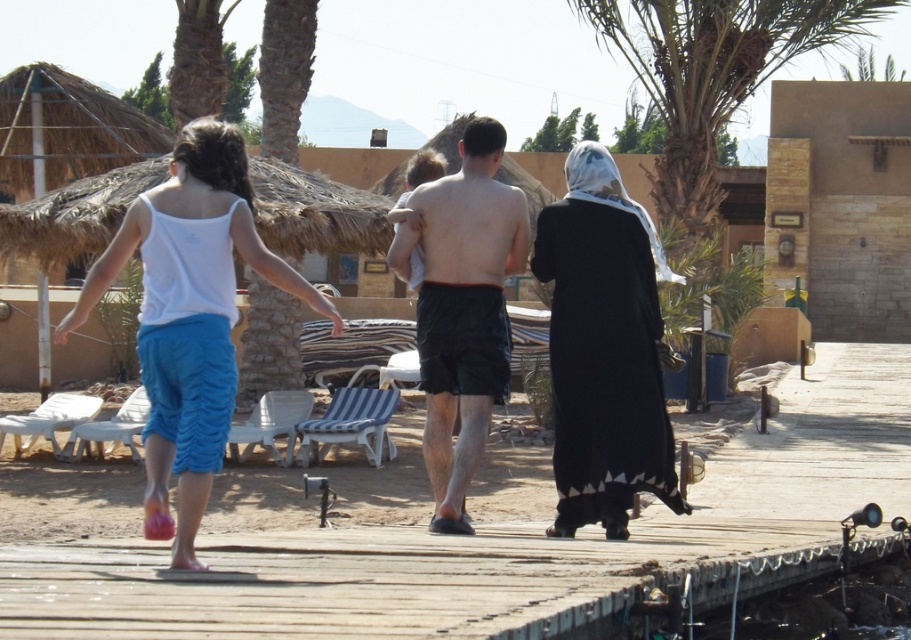
Can you confirm if black cotton dress at center is bigger than black matte shorts at center?

Actually, black cotton dress at center might be smaller than black matte shorts at center.

Does point (448, 260) come in front of point (439, 417)?

Yes, point (448, 260) is in front of point (439, 417).

Is point (451, 285) farther from viewer compared to point (456, 252)?

Yes, it is behind point (456, 252).

Identify the location of black cotton dress at center. [462, 305].

Is wooden dock at center below white cotton tank top at upper left?

Correct, wooden dock at center is located below white cotton tank top at upper left.

Which is above, wooden dock at center or white cotton tank top at upper left?

white cotton tank top at upper left is above.

The image size is (911, 640). I want to click on wooden dock at center, so click(x=508, y=544).

Consider the image. Between white cotton tank top at upper left and white fabric dress at center, which one has more height?

With more height is white cotton tank top at upper left.

Which is in front, point (445, 237) or point (254, 228)?

Positioned in front is point (445, 237).

This screenshot has height=640, width=911. Describe the element at coordinates (466, 289) in the screenshot. I see `white cotton tank top at upper left` at that location.

The width and height of the screenshot is (911, 640). Find the location of `white cotton tank top at upper left`. white cotton tank top at upper left is located at coordinates (466, 289).